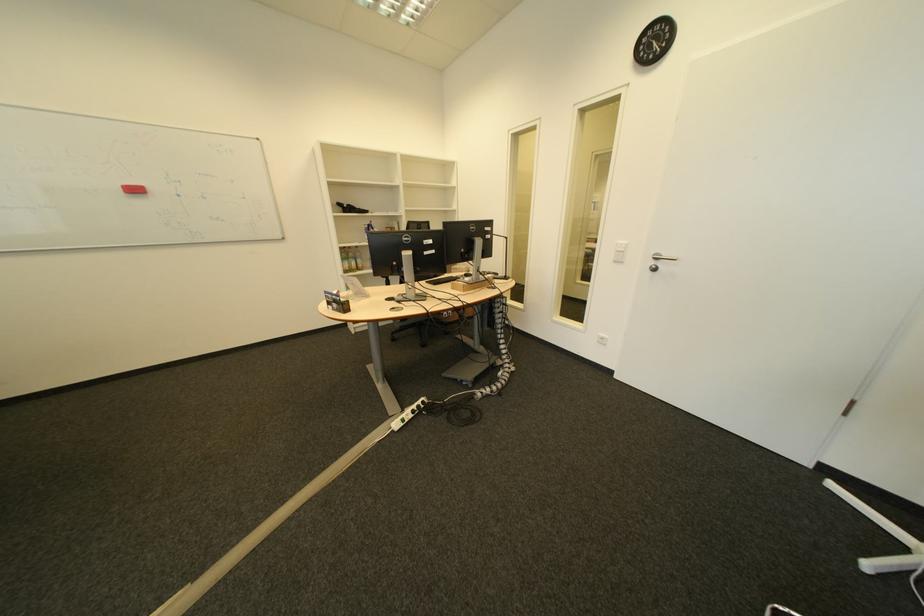
This screenshot has height=616, width=924. Identify the location of chair sitting surface. (407, 318).